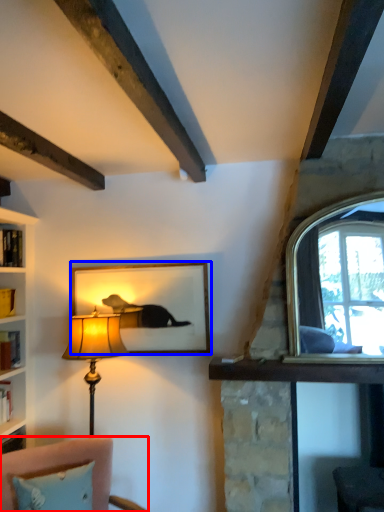
Question: Which object appears farthest to the camera in this image, furniture (highlighted by a red box) or picture frame (highlighted by a blue box)?

Choices:
 (A) furniture
 (B) picture frame

Answer: (B)